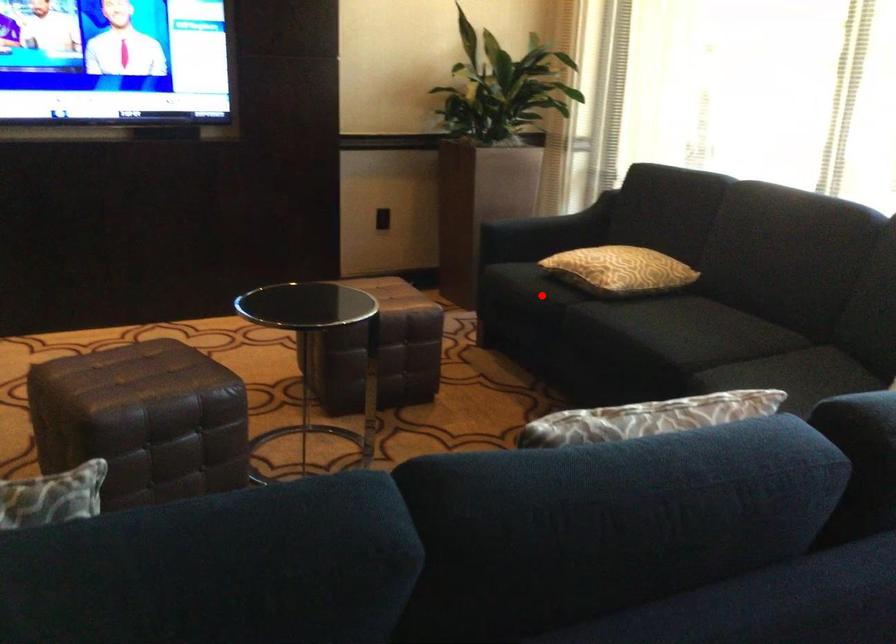
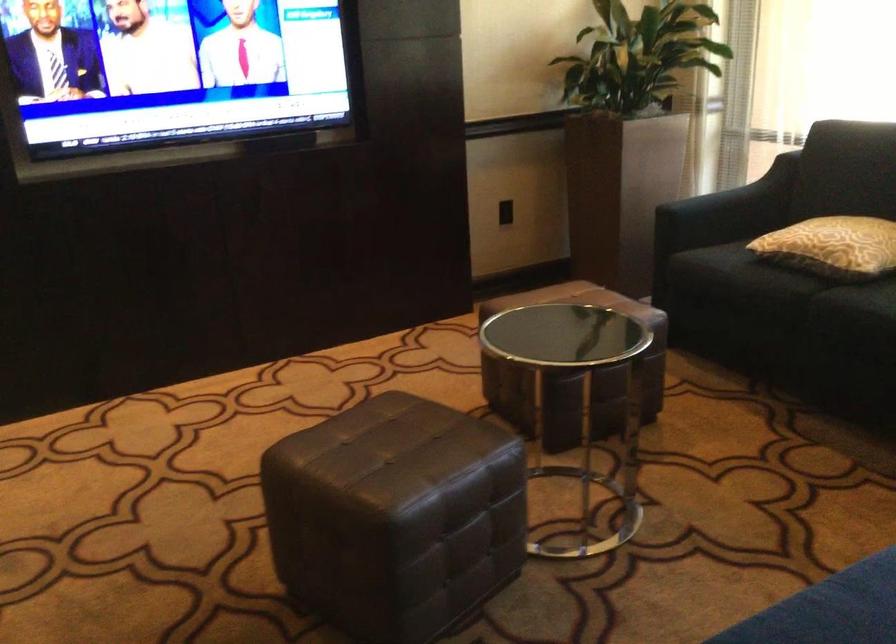
Find the pixel in the second image that matches the highlighted location in the first image.

(767, 283)